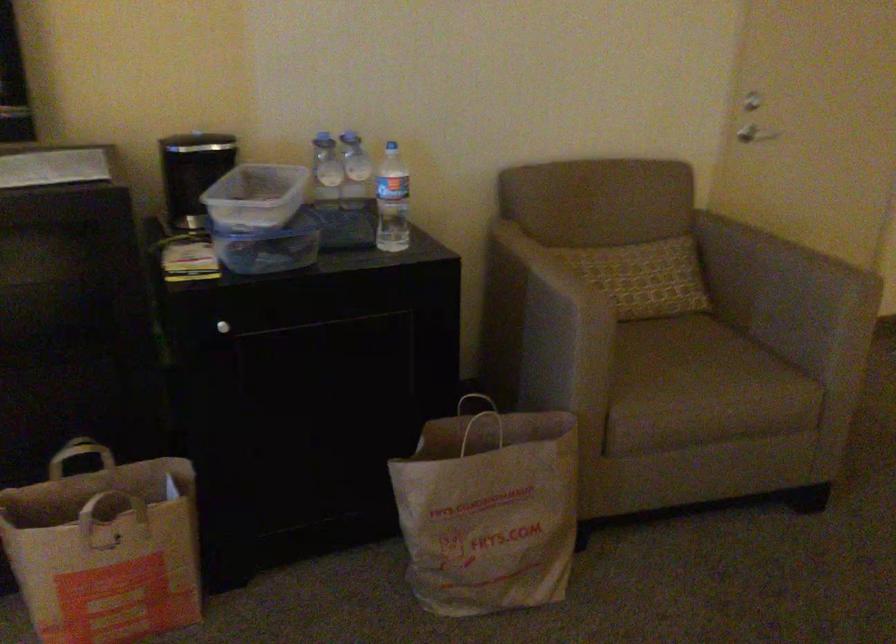
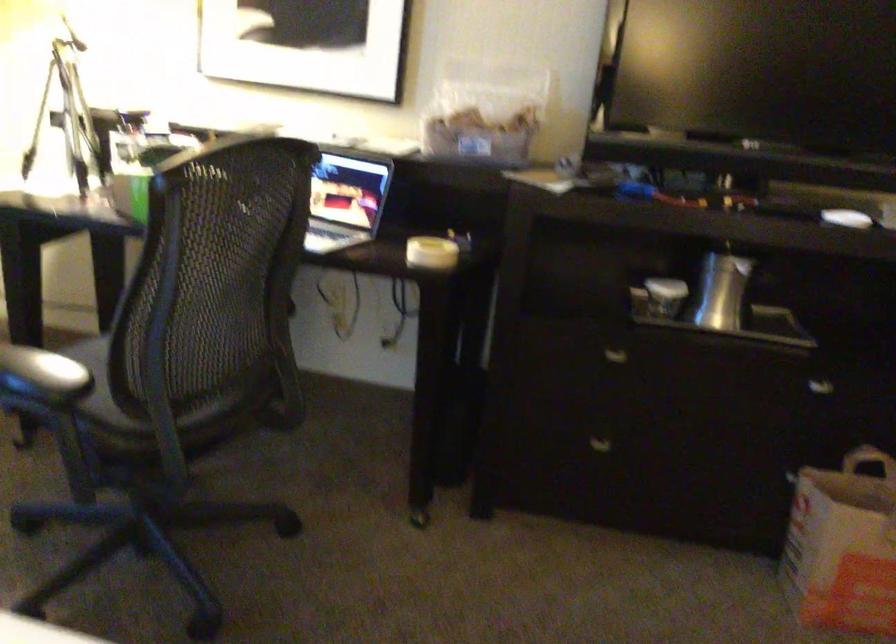
The point at [73,462] is marked in the first image. Where is the corresponding point in the second image?

(867, 460)